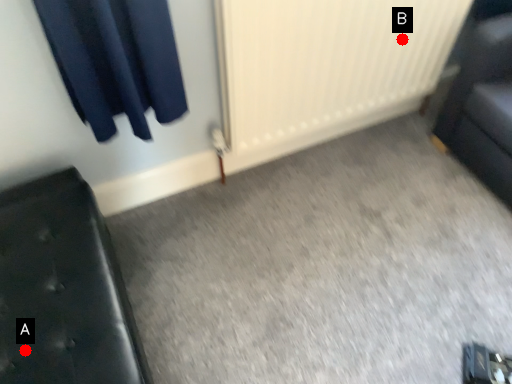
Question: Two points are circled on the image, labeled by A and B beside each circle. Which point is further to the camera?

Choices:
 (A) A is further
 (B) B is further

Answer: (B)